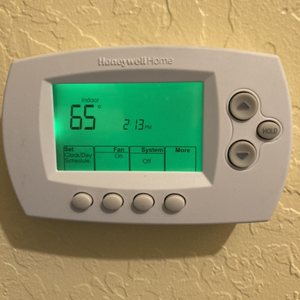
Where is `off-yellow wall`? off-yellow wall is located at coordinates pos(182,18).